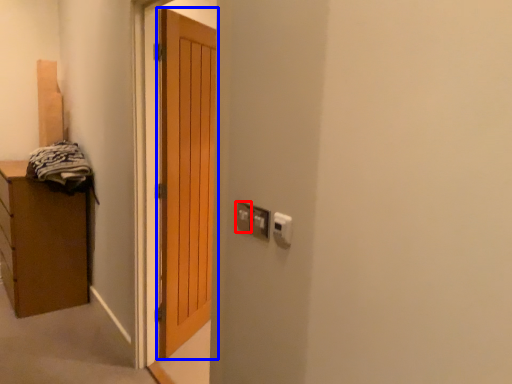
Question: Which of the following is the closest to the observer, electric outlet (highlighted by a red box) or door (highlighted by a blue box)?

Choices:
 (A) electric outlet
 (B) door

Answer: (A)